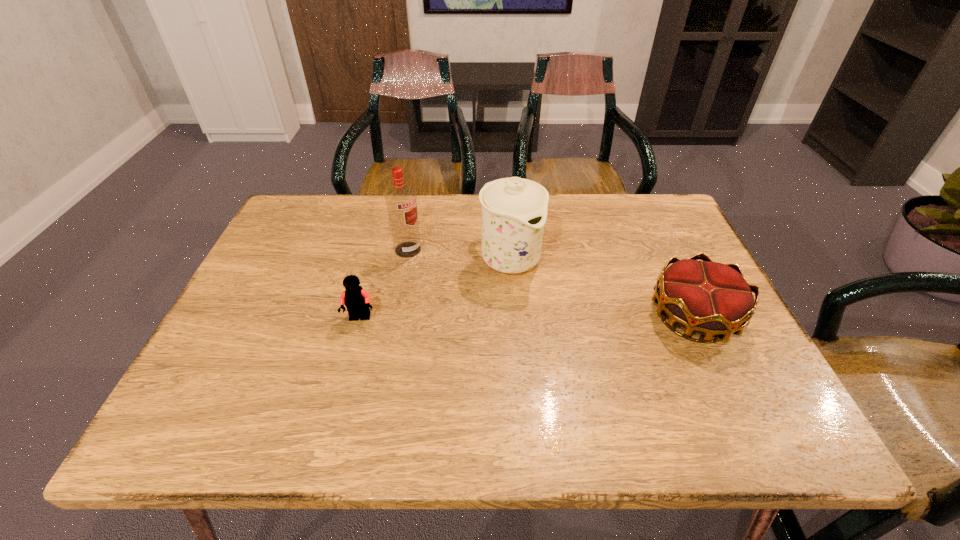
Locate an element on the screen. free space between the leftmost object and the rightmost object is located at coordinates (527, 317).

Locate an element on the screen. This screenshot has height=540, width=960. free point between the Lego and the second object from right to left is located at coordinates (435, 288).

Where is `vacant point located between the crown and the chinaware`? The image size is (960, 540). vacant point located between the crown and the chinaware is located at coordinates (602, 287).

You are a GUI agent. You are given a task and a screenshot of the screen. Output one action in this format:
    pyautogui.click(x=<x>, y=<y>)
    Task: Click on the unoccupied position between the second object from left to right and the chinaware
    
    Given the screenshot: What is the action you would take?
    pyautogui.click(x=459, y=254)

Identify the location of unoccupied area between the second object from right to left and the vodka. (459, 254).

You are a GUI agent. You are given a task and a screenshot of the screen. Output one action in this format:
    pyautogui.click(x=<x>, y=<y>)
    Task: Click on the vacant space in between the leftmost object and the second object from left to right
    The width and height of the screenshot is (960, 540).
    Given the screenshot: What is the action you would take?
    pyautogui.click(x=384, y=284)

The image size is (960, 540). What are the coordinates of `free space between the second object from left to right and the third object from left to right` in the screenshot? It's located at (459, 254).

This screenshot has width=960, height=540. Identify the location of free spot between the rightmost object and the Lego. (527, 317).

Where is `unoccupied area between the rightmost object and the Lego`? unoccupied area between the rightmost object and the Lego is located at coordinates (527, 317).

This screenshot has width=960, height=540. I want to click on free point between the crown and the chinaware, so click(x=602, y=287).